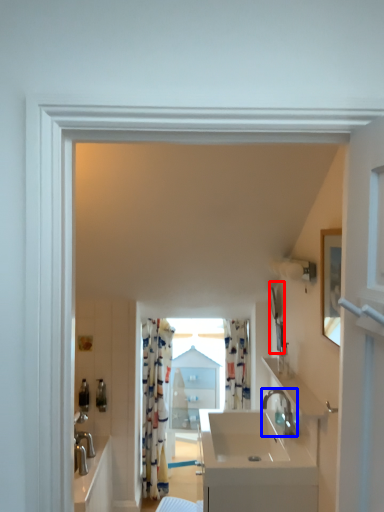
Question: Which object appears closest to the camera in this image, mirror (highlighted by a red box) or tap (highlighted by a blue box)?

Choices:
 (A) mirror
 (B) tap

Answer: (B)